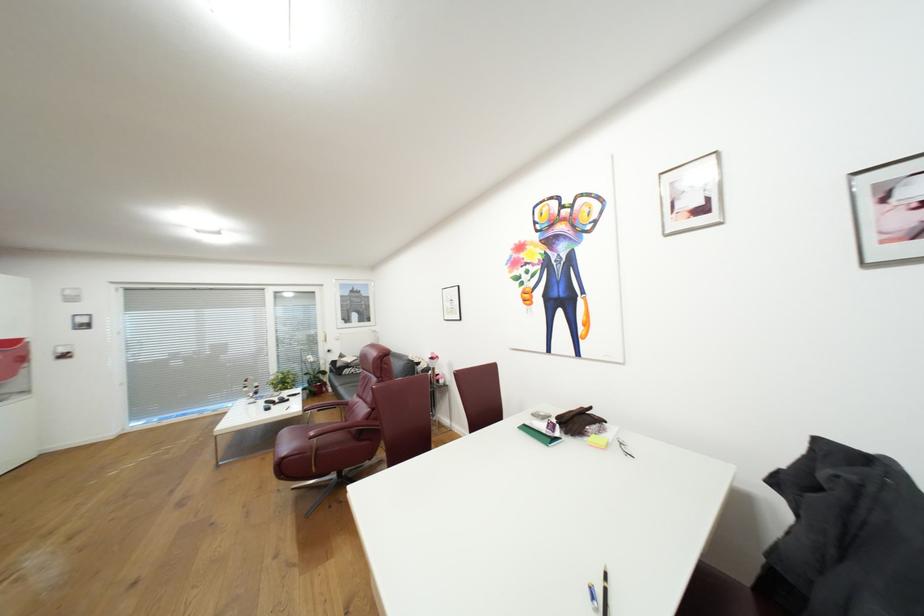
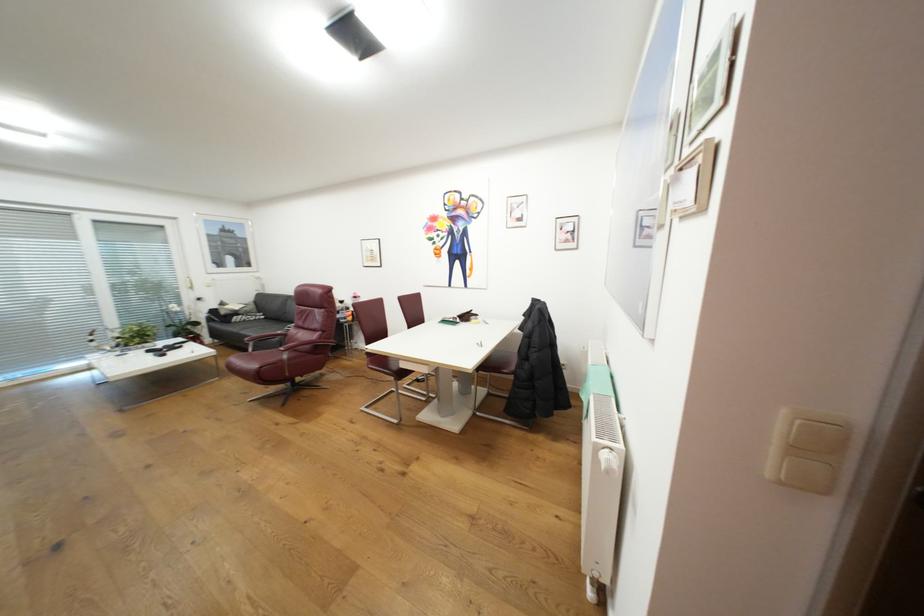
Where in the second image is the point corresponding to pixel 289 458 from the first image?

(268, 368)